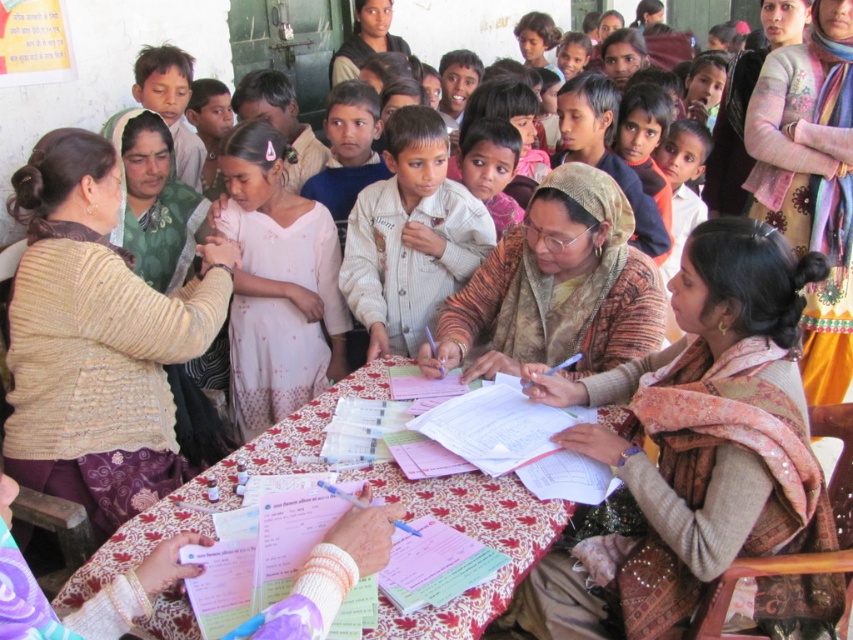
Can you confirm if matte brown shawl at center is bigger than pink fabric dress at center?

Yes, matte brown shawl at center is bigger than pink fabric dress at center.

Who is positioned more to the left, matte brown shawl at center or pink fabric dress at center?

Positioned to the left is pink fabric dress at center.

Is point (567, 600) closer to camera compared to point (315, 374)?

Yes.

Locate an element on the screen. The width and height of the screenshot is (853, 640). matte brown shawl at center is located at coordinates (711, 426).

Can you confirm if beige sweater at center is positioned to the left of light beige jacket at center?

Correct, you'll find beige sweater at center to the left of light beige jacket at center.

Image resolution: width=853 pixels, height=640 pixels. What do you see at coordinates (96, 339) in the screenshot?
I see `beige sweater at center` at bounding box center [96, 339].

Which is in front, point (80, 500) or point (346, 280)?

Positioned in front is point (80, 500).

The width and height of the screenshot is (853, 640). I want to click on beige sweater at center, so click(x=96, y=339).

Who is higher up, matte brown shawl at center or printed fabric scarf at upper right?

printed fabric scarf at upper right is higher up.

Is matte brown shawl at center shorter than printed fabric scarf at upper right?

Yes.

Image resolution: width=853 pixels, height=640 pixels. Describe the element at coordinates (711, 426) in the screenshot. I see `matte brown shawl at center` at that location.

Find the location of `matte brown shawl at center`. matte brown shawl at center is located at coordinates (711, 426).